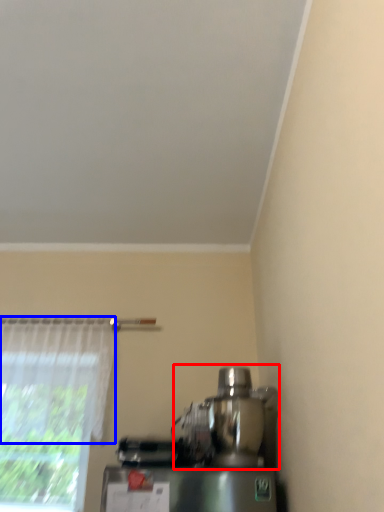
Question: Which of the following is the farthest to the observer, mixer (highlighted by a red box) or curtain (highlighted by a blue box)?

Choices:
 (A) mixer
 (B) curtain

Answer: (B)